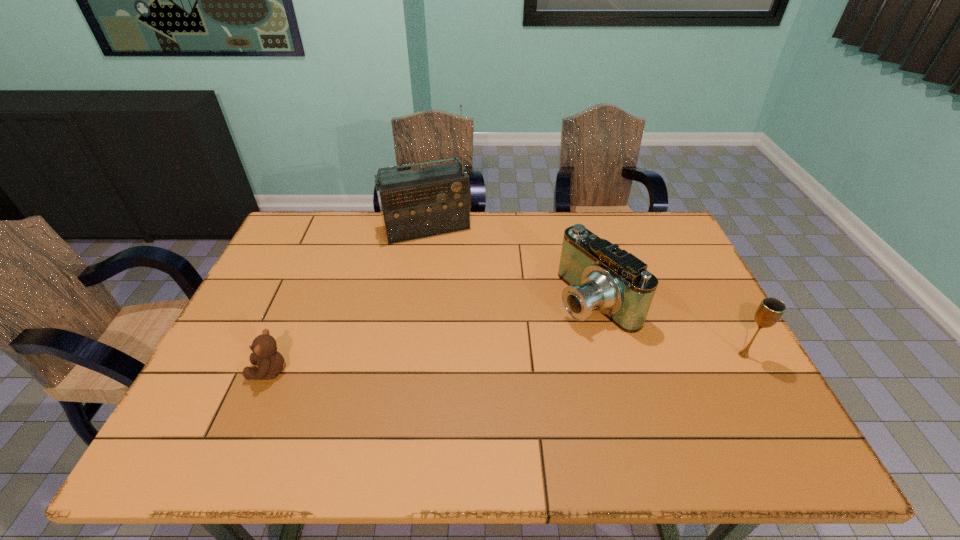
Find the location of a particular element. The image size is (960, 540). vacant space located on the front panel of the radio receiver is located at coordinates (460, 295).

At what (x,y) coordinates should I click in order to perform the action: click on vacant space located 0.200m on the front panel of the radio receiver. Please return your answer as a coordinate pair (x, y). Looking at the image, I should click on (455, 284).

Where is `free space located on the front panel of the radio receiver`? free space located on the front panel of the radio receiver is located at coordinates (472, 325).

I want to click on free space located 0.230m on the front-facing side of the camcorder, so [x=497, y=356].

I want to click on vacant space located 0.260m on the front-facing side of the camcorder, so click(x=488, y=362).

The width and height of the screenshot is (960, 540). Identify the location of blank space located 0.200m on the front-facing side of the camcorder. (507, 351).

This screenshot has height=540, width=960. I want to click on object that is positioned at the far edge, so click(x=435, y=200).

The image size is (960, 540). I want to click on object located in the near edge section of the desktop, so point(270,362).

Find the location of `object positioned at the left edge`. object positioned at the left edge is located at coordinates (270, 362).

Identify the location of object located in the right edge section of the desktop. This screenshot has height=540, width=960. (770, 310).